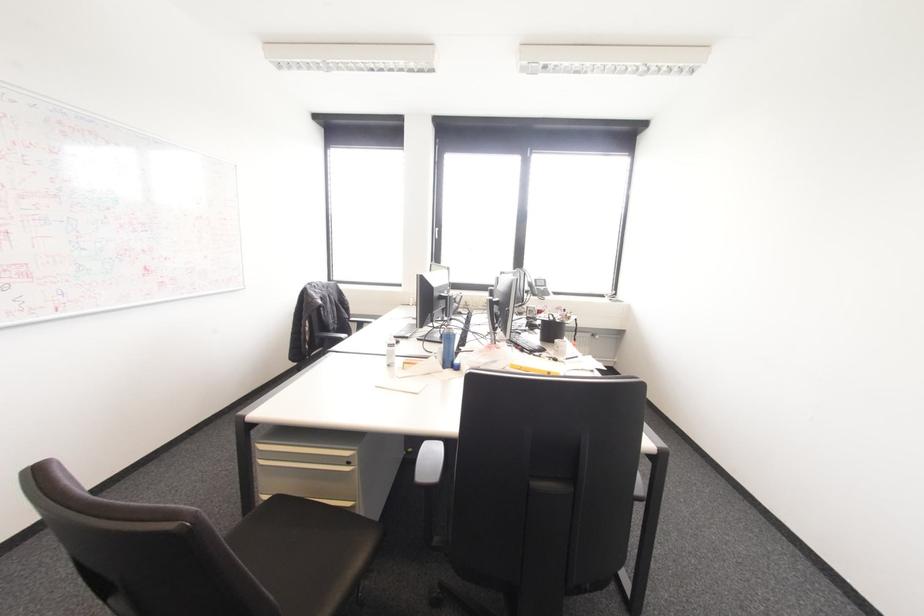
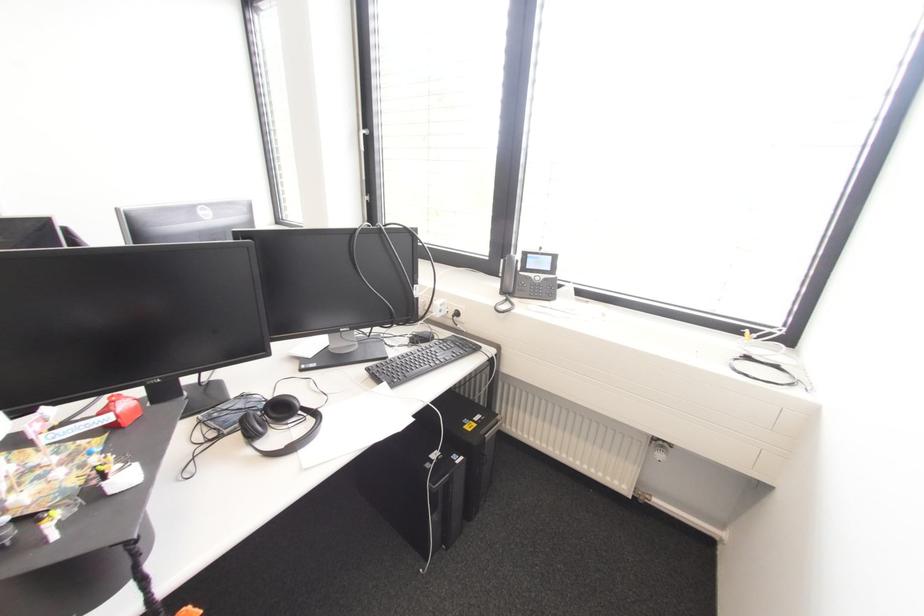
Locate, in the second image, the point that corresponds to point (436, 229) in the first image.

(361, 132)